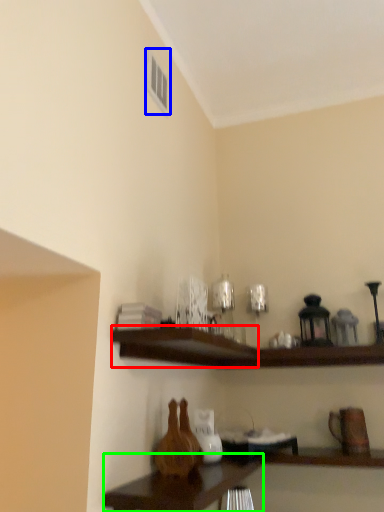
Question: Which is nearer to the shelf (highlighted by a red box)? window (highlighted by a blue box) or table (highlighted by a green box).

Choices:
 (A) window
 (B) table

Answer: (B)